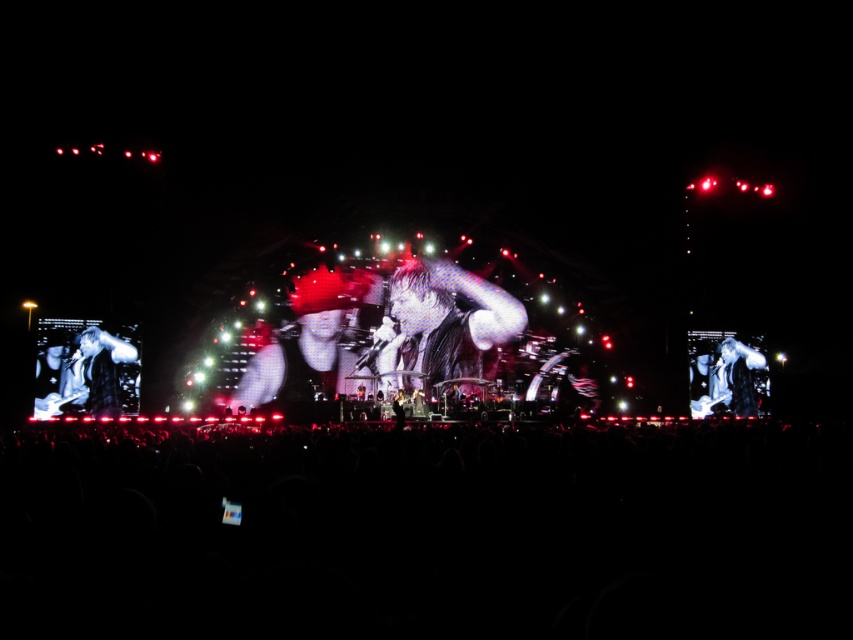
You are standing at the center of the concert venue. There is a point marked at coordinates point (430, 532). What is located at that point?

The point (430, 532) marks the black matte crowd at lower center.

You are a photographer at the concert. You want to take a photo of the shiny black microphone at center without the dark hair at left blocking it. What should you do?

Move to the right side so that the dark hair at left is no longer in front of the shiny black microphone at center.

You are a photographer at the concert. You want to capture a photo that includes both the black matte crowd at lower center and the dark hair at left. Based on their positions, which one should be placed lower in the frame to ensure both are visible?

The black matte crowd at lower center should be placed lower in the frame because it is located below the dark hair at left, so positioning it lower will ensure both elements are visible in the photo.